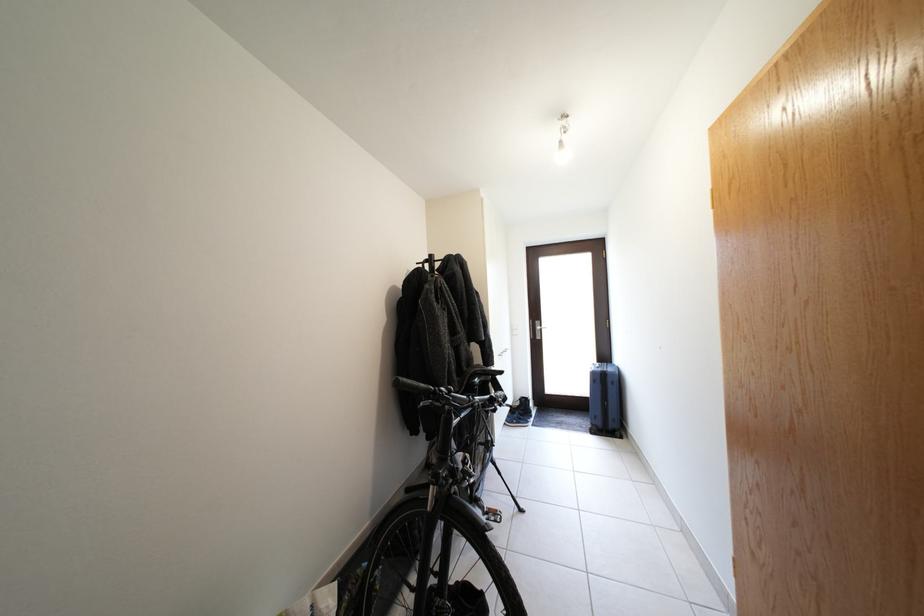
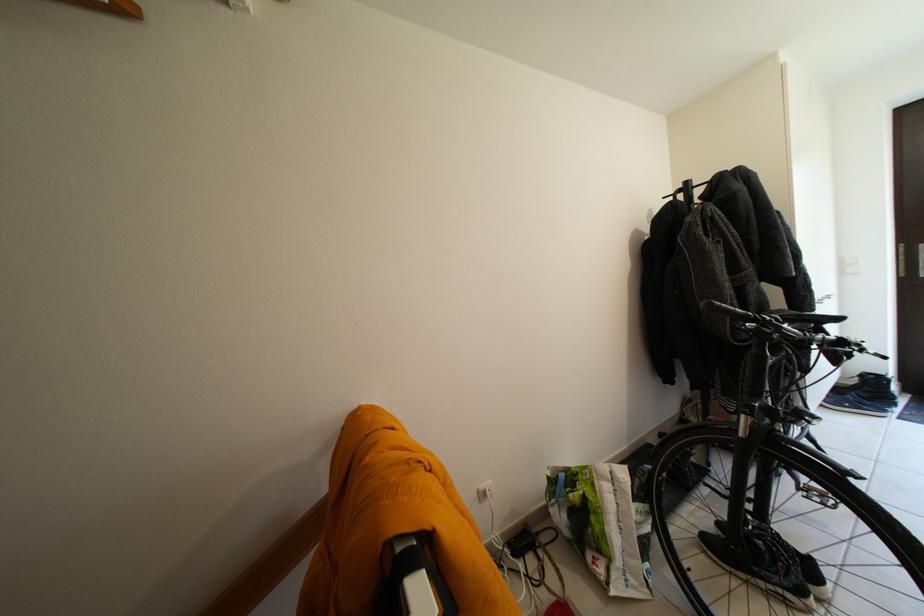
The point at (x=500, y=403) is marked in the first image. Where is the corresponding point in the second image?

(849, 344)